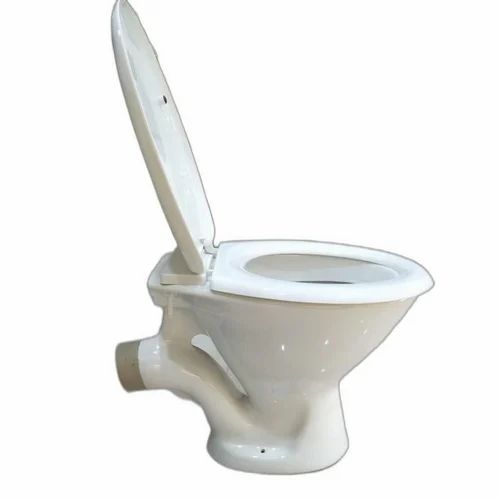
The image size is (500, 500). Find the location of `toilet`. toilet is located at coordinates (316, 343).